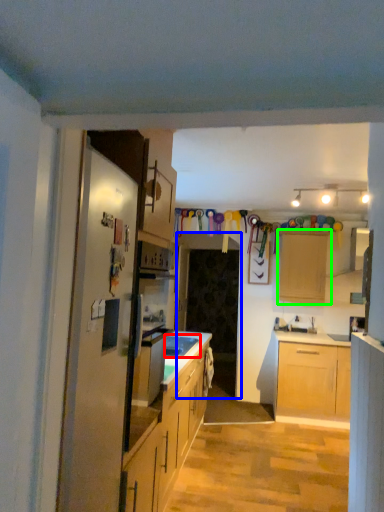
Question: Which object is the farthest from sink (highlighted by a red box)? Choose among these: glass door (highlighted by a blue box) or cabinetry (highlighted by a green box).

Choices:
 (A) glass door
 (B) cabinetry

Answer: (B)